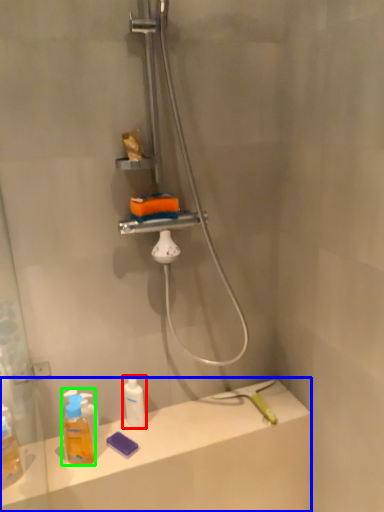
Question: Based on their relative distances, which object is farther from mouthwash (highlighted by a red box)? Choose from counter top (highlighted by a blue box) and mouthwash (highlighted by a green box).

Choices:
 (A) counter top
 (B) mouthwash

Answer: (A)